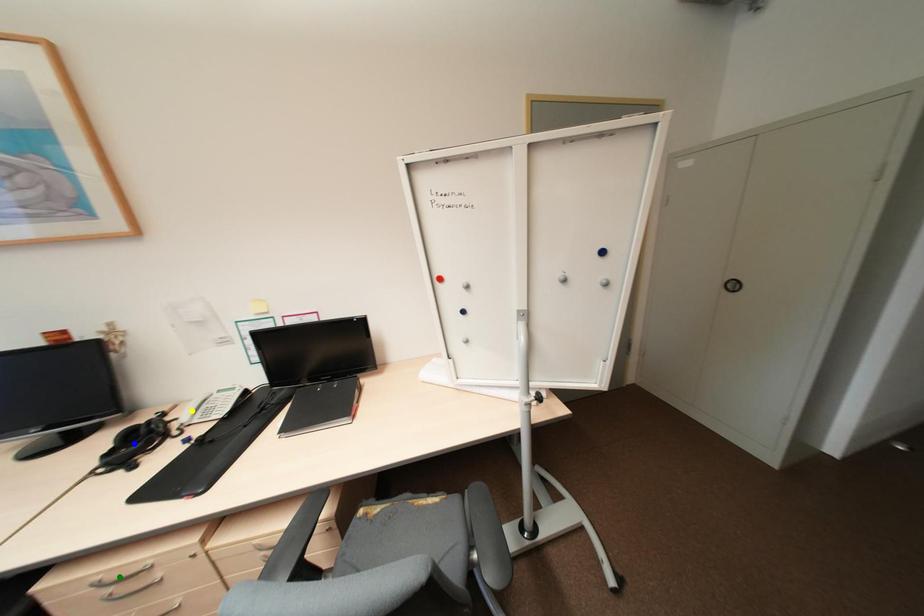
Order these from nearest to farthest:
blue point | yellow point | green point

green point → blue point → yellow point